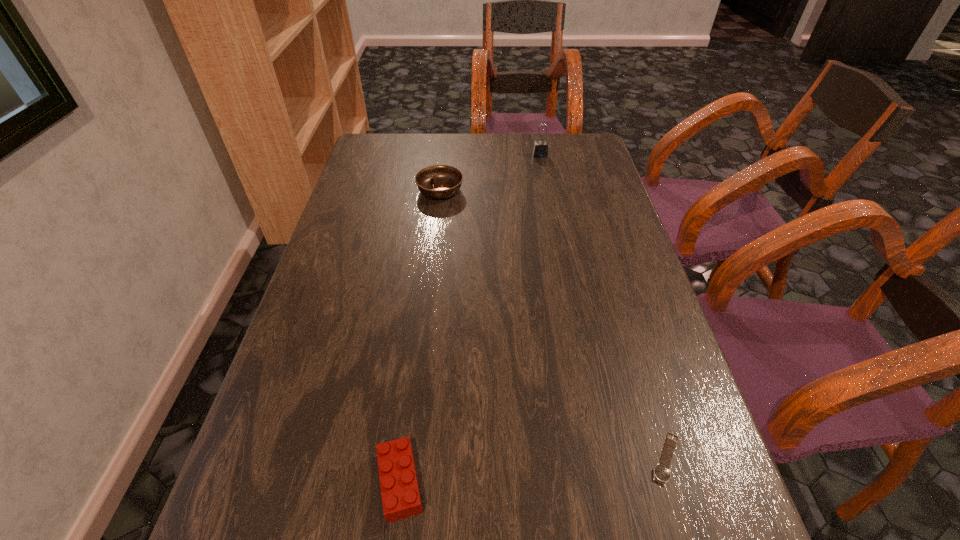
Where is `padlock`? padlock is located at coordinates (540, 150).

Locate an element on the screen. The image size is (960, 540). the third object from left to right is located at coordinates (540, 150).

Where is `soup bowl`? The image size is (960, 540). soup bowl is located at coordinates (437, 181).

Locate an element on the screen. Lego is located at coordinates (400, 493).

The image size is (960, 540). I want to click on watch, so click(x=661, y=473).

This screenshot has width=960, height=540. I want to click on the shortest object, so click(x=661, y=473).

Find the location of `vacant point located 0.180m on the shackle of the tallest object`. vacant point located 0.180m on the shackle of the tallest object is located at coordinates (546, 189).

Identify the location of vacant space located on the right of the soup bowl. [x=531, y=191].

Find the location of a particular element. The height and width of the screenshot is (540, 960). free spot located on the back of the Lego is located at coordinates (420, 323).

The height and width of the screenshot is (540, 960). In order to click on free space located on the back of the shortest object in this screenshot , I will do `click(615, 288)`.